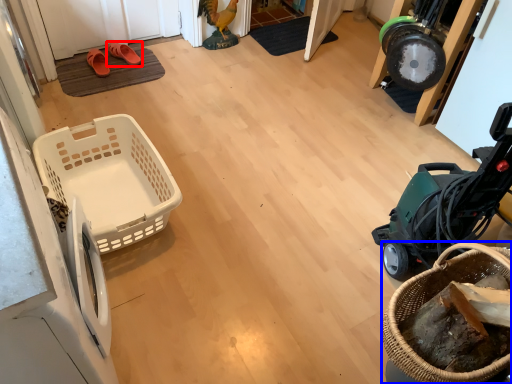
Question: Among these objects, which one is nearest to the camera, footwear (highlighted by a red box) or basket (highlighted by a blue box)?

Choices:
 (A) footwear
 (B) basket

Answer: (B)